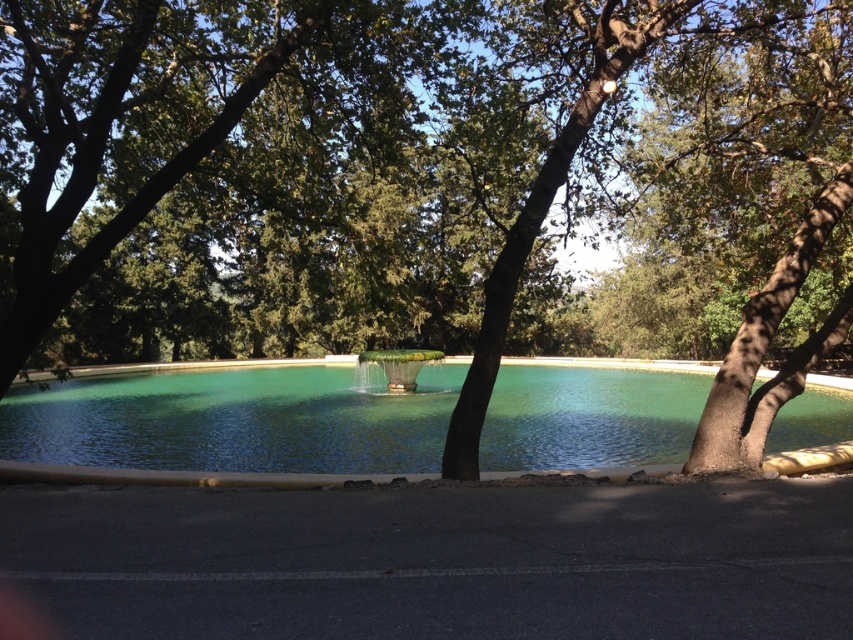
You are standing at the edge of the pool and want to know which object is higher between the green leafy tree at center and the green marble fountain at center. Can you tell me?

The green leafy tree at center is above the green marble fountain at center, so the green leafy tree at center is higher.

You are standing at the edge of the pool and see the point marked at coordinates point (532, 193). What is the nearest object to that point?

The point (532, 193) is on green leafy tree at center, so the nearest object to that point is the green leafy tree at center.

You are standing at the edge of the pool and want to walk directly to the green marble fountain at center. However, there is a green leafy tree at center in your path. Which direction should you move to avoid the tree and reach the fountain?

The green leafy tree at center is to the right of the green marble fountain at center, so you should move to the left to avoid the tree and reach the fountain.